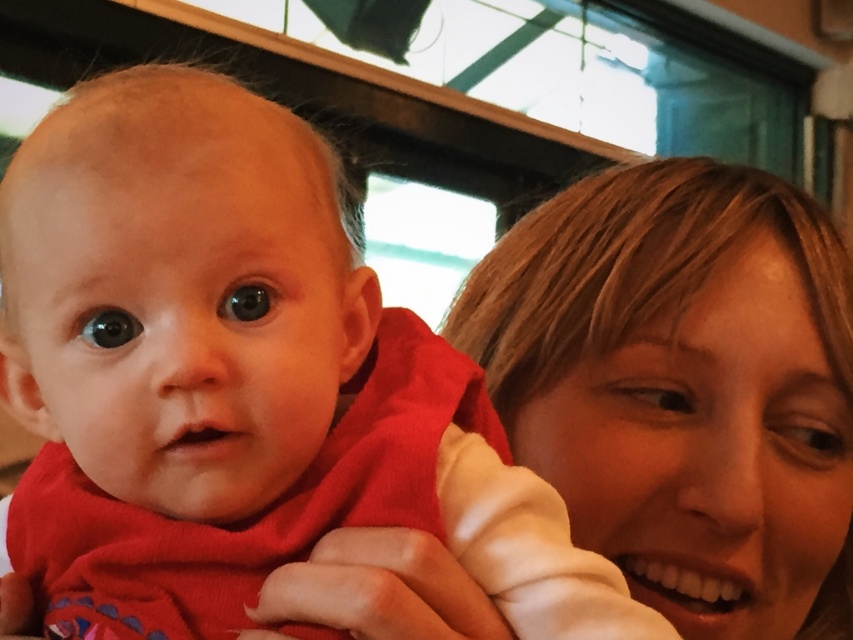
The height and width of the screenshot is (640, 853). I want to click on red soft baby at center, so click(236, 380).

Which of these two, red soft baby at center or smooth blonde hair at right, stands taller?

With more height is smooth blonde hair at right.

Is point (158, 161) behind point (773, 225)?

No, (158, 161) is closer to viewer.

This screenshot has height=640, width=853. I want to click on red soft baby at center, so click(236, 380).